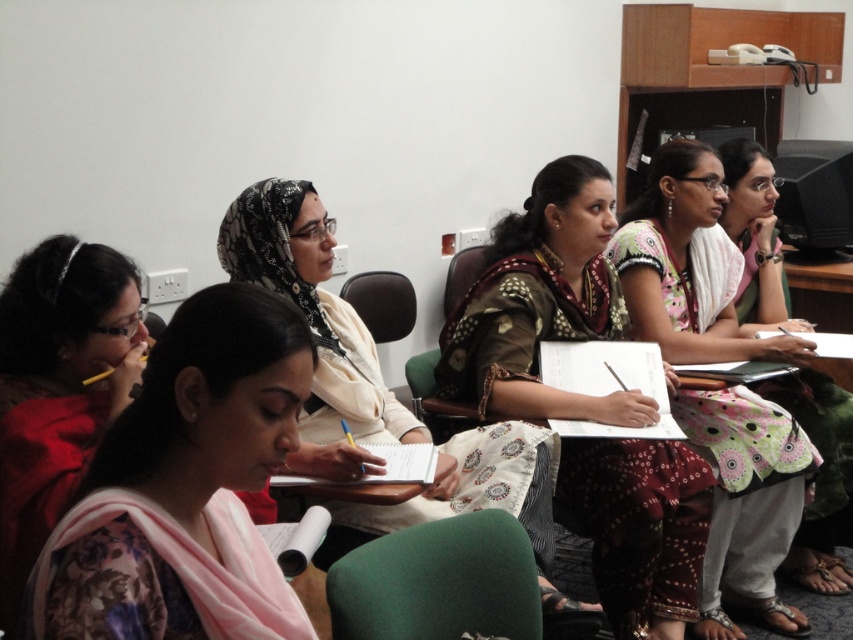
Question: Is printed cotton saree at center to the right of matte beige scarf at center from the viewer's perspective?

Choices:
 (A) no
 (B) yes

Answer: (B)

Question: Does floral fabric scarf at lower left appear over matte black scarf at lower left?

Choices:
 (A) yes
 (B) no

Answer: (B)

Question: Estimate the real-world distances between objects in this image. Which object is farther from the printed cotton saree at center?

Choices:
 (A) matte black chair at center
 (B) polka dot fabric dress at center

Answer: (A)

Question: Which point appears closest to the camera in this image?

Choices:
 (A) (706, 403)
 (B) (465, 576)
 (C) (376, 289)
 (D) (119, 496)

Answer: (D)

Question: Among these points, which one is nearest to the camera?

Choices:
 (A) (780, 508)
 (B) (820, 397)
 (C) (440, 563)

Answer: (C)

Question: Is printed cotton saree at center behind green fabric chair at center?

Choices:
 (A) no
 (B) yes

Answer: (B)